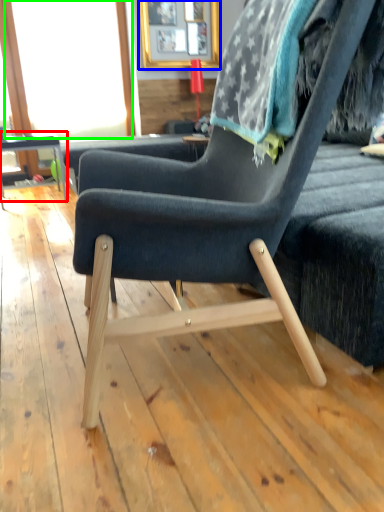
Question: Which is farther away from table (highlighted by a red box)? picture frame (highlighted by a blue box) or window screen (highlighted by a green box)?

Choices:
 (A) picture frame
 (B) window screen

Answer: (A)